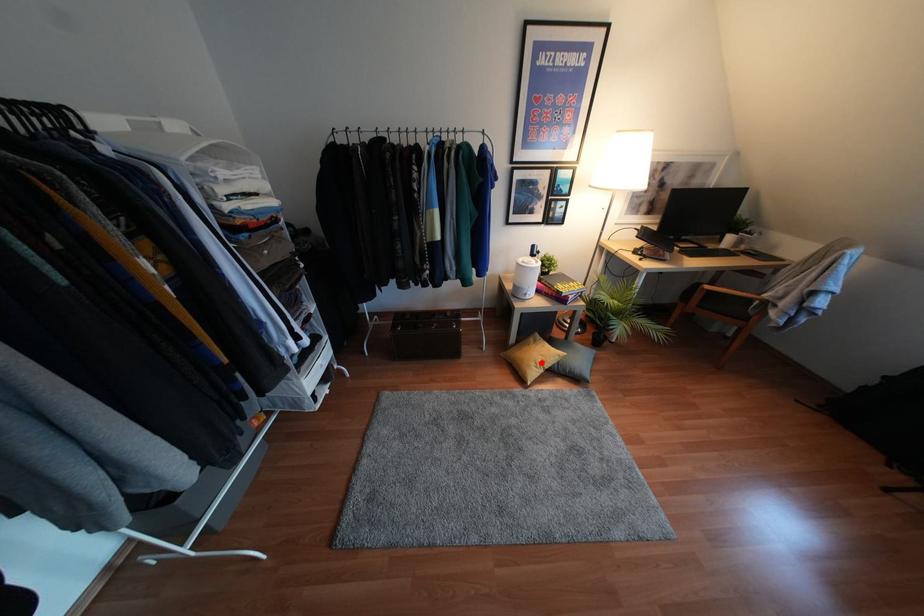
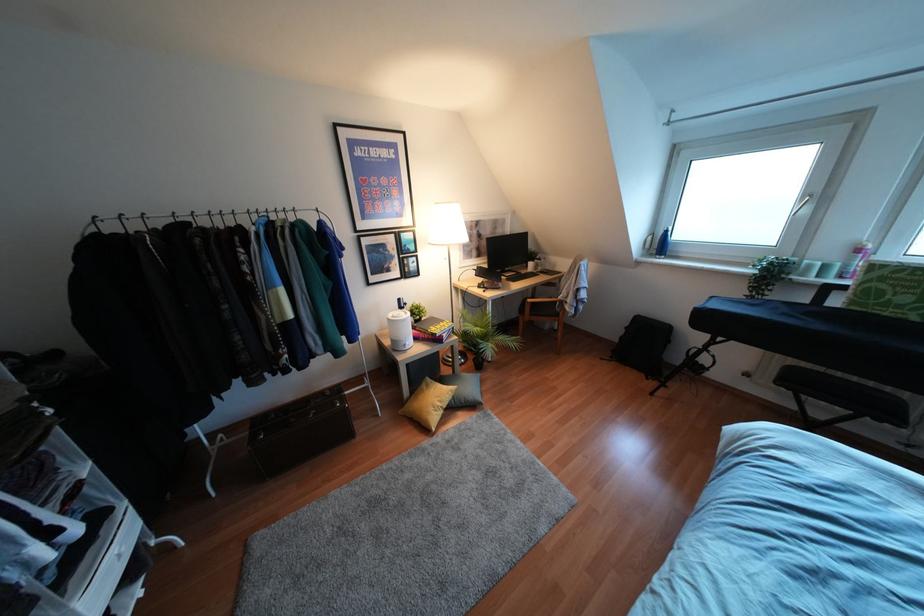
In the second image, find the point that corresponds to the highlighted location in the first image.

(439, 403)